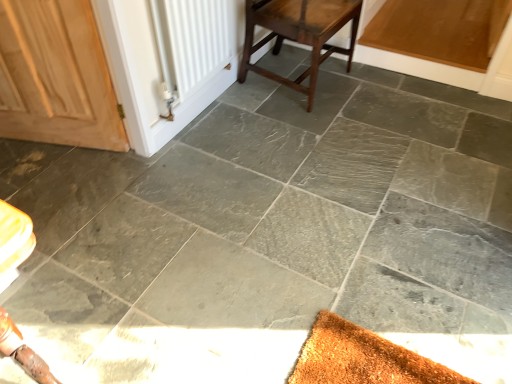
Question: Considering the positions of white matte radiator at upper left and wooden door at left in the image, is white matte radiator at upper left taller or shorter than wooden door at left?

Choices:
 (A) short
 (B) tall

Answer: (A)

Question: From the image's perspective, is white matte radiator at upper left located above or below wooden door at left?

Choices:
 (A) below
 (B) above

Answer: (B)

Question: Which is farther from the dark brown wood stool at center?

Choices:
 (A) white matte radiator at upper left
 (B) wooden door at left

Answer: (B)

Question: Which of these objects is positioned closest to the wooden door at left?

Choices:
 (A) white matte radiator at upper left
 (B) dark brown wood stool at center

Answer: (A)